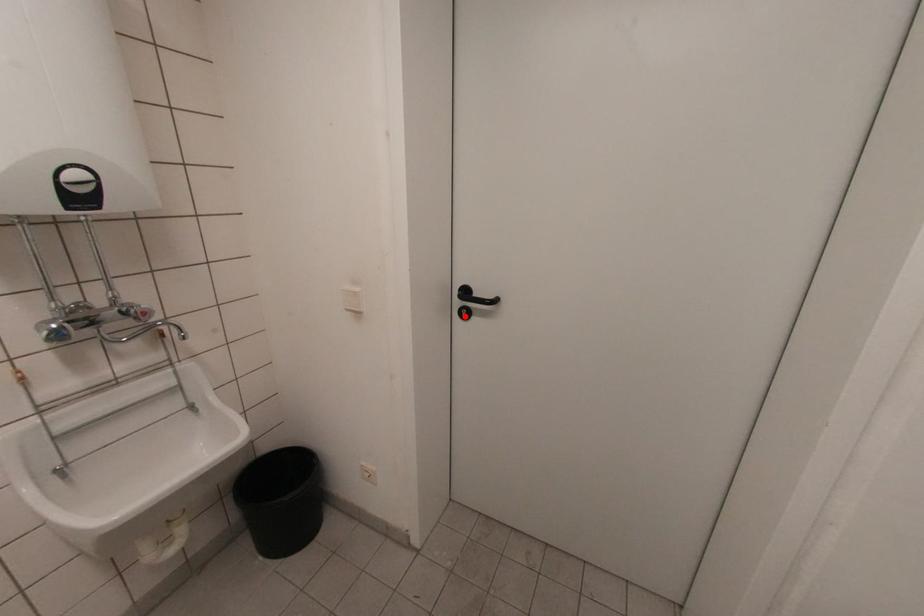
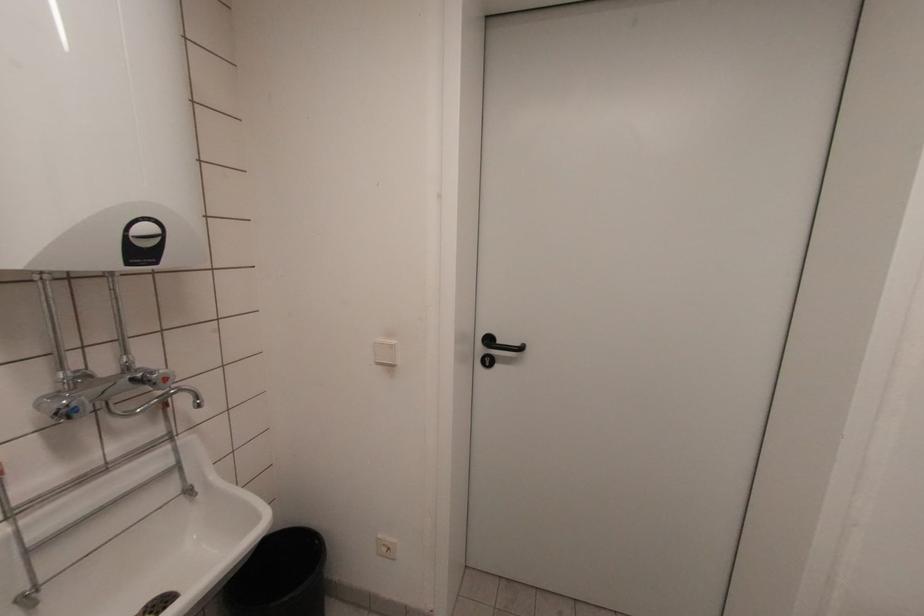
Where in the second image is the point corresponding to the highlighted location from the first image?

(488, 363)